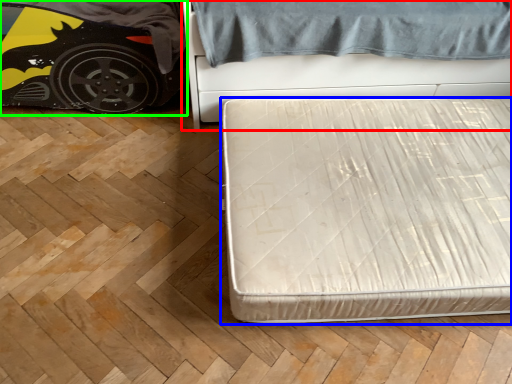
Question: Based on their relative distances, which object is farther from bed (highlighted by a red box)? Choose from bed (highlighted by a blue box) and car (highlighted by a green box).

Choices:
 (A) bed
 (B) car

Answer: (B)